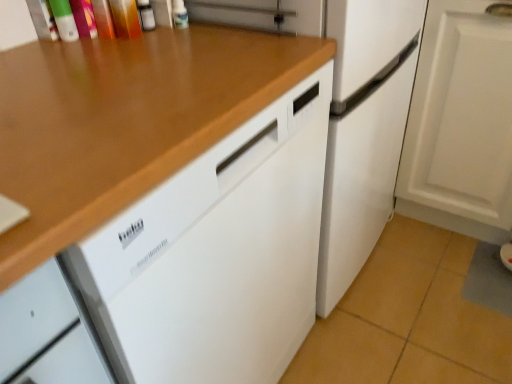
Question: Is white matte cabinet at lower right at the left side of white matte refrigerator at center?

Choices:
 (A) no
 (B) yes

Answer: (A)

Question: Is white matte cabinet at lower right further to camera compared to white matte refrigerator at center?

Choices:
 (A) no
 (B) yes

Answer: (B)

Question: Is white matte cabinet at lower right in front of white matte refrigerator at center?

Choices:
 (A) yes
 (B) no

Answer: (B)

Question: Considering the relative sizes of white matte cabinet at lower right and white matte refrigerator at center in the image provided, is white matte cabinet at lower right wider than white matte refrigerator at center?

Choices:
 (A) no
 (B) yes

Answer: (A)

Question: From a real-world perspective, does white matte cabinet at lower right sit lower than white matte refrigerator at center?

Choices:
 (A) no
 (B) yes

Answer: (B)

Question: Is white matte refrigerator at center to the left or to the right of white matte cabinet at lower right in the image?

Choices:
 (A) left
 (B) right

Answer: (A)

Question: In the image, is white matte refrigerator at center positioned in front of or behind white matte cabinet at lower right?

Choices:
 (A) behind
 (B) front

Answer: (B)

Question: Is white matte refrigerator at center taller or shorter than white matte cabinet at lower right?

Choices:
 (A) tall
 (B) short

Answer: (A)

Question: Is point (337, 16) positioned closer to the camera than point (450, 21)?

Choices:
 (A) closer
 (B) farther

Answer: (A)

Question: Is wooden at upper left bigger or smaller than white matte cabinet at lower right?

Choices:
 (A) small
 (B) big

Answer: (B)

Question: Is point (66, 112) closer or farther from the camera than point (462, 4)?

Choices:
 (A) closer
 (B) farther

Answer: (A)

Question: Is wooden at upper left in front of or behind white matte cabinet at lower right in the image?

Choices:
 (A) behind
 (B) front

Answer: (B)

Question: From the image's perspective, is wooden at upper left positioned above or below white matte cabinet at lower right?

Choices:
 (A) below
 (B) above

Answer: (A)

Question: Choose the correct answer: Is wooden at upper left inside white matte refrigerator at center or outside it?

Choices:
 (A) outside
 (B) inside

Answer: (A)

Question: In terms of height, does wooden at upper left look taller or shorter compared to white matte refrigerator at center?

Choices:
 (A) short
 (B) tall

Answer: (A)